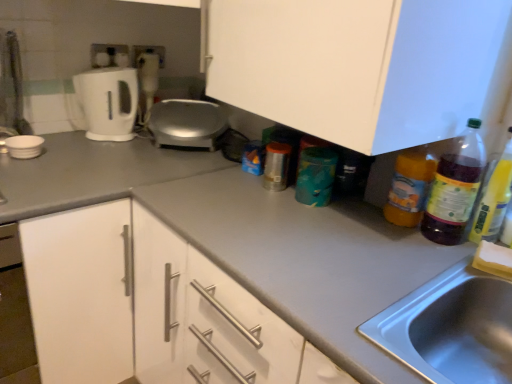
You are a GUI agent. You are given a task and a screenshot of the screen. Output one action in this format:
    pyautogui.click(x=<x>, y=<y>)
    Task: Click on the free space in front of white matte bowl at left, the 1th appliance in the front-to-back sequence
    
    Given the screenshot: What is the action you would take?
    pyautogui.click(x=20, y=170)